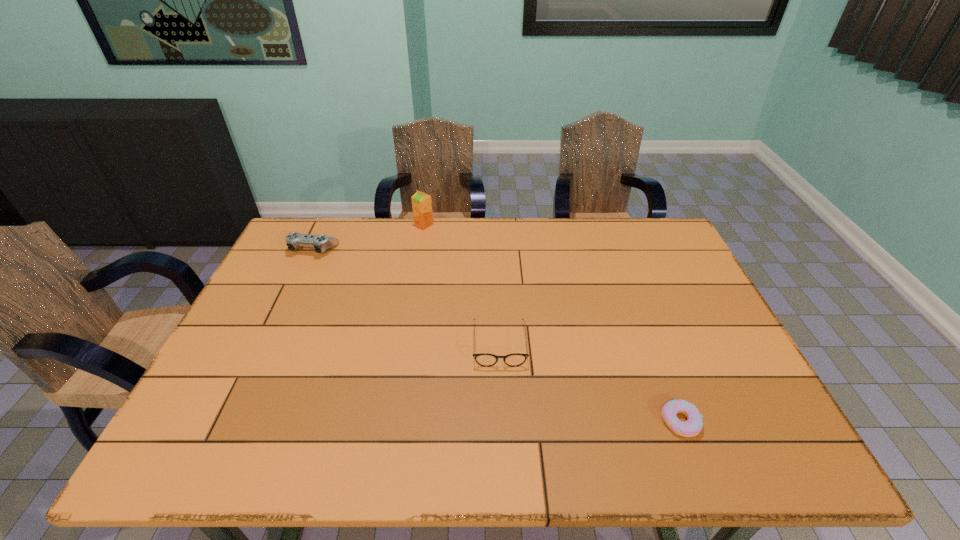
In the image, there is a desktop. What are the coordinates of `vacant region at the right edge` in the screenshot? It's located at (761, 414).

In the image, there is a desktop. At what (x,y) coordinates should I click in order to perform the action: click on free space at the far left corner. Please return your answer as a coordinate pair (x, y). Looking at the image, I should click on (304, 218).

The image size is (960, 540). I want to click on free space at the far right corner of the desktop, so click(x=644, y=239).

At what (x,y) coordinates should I click in order to perform the action: click on empty location between the shortest object and the third object from right to left. Please return your answer as a coordinate pair (x, y). Looking at the image, I should click on (552, 323).

Where is `free space between the tallest object and the second farthest object`? Image resolution: width=960 pixels, height=540 pixels. free space between the tallest object and the second farthest object is located at coordinates (369, 237).

Where is `free space between the tallest object and the rightmost object`? The width and height of the screenshot is (960, 540). free space between the tallest object and the rightmost object is located at coordinates (552, 323).

The height and width of the screenshot is (540, 960). Find the location of `free area in between the third object from left to right and the farthest object`. free area in between the third object from left to right and the farthest object is located at coordinates (462, 285).

Find the location of a particular element. This screenshot has height=540, width=960. free space that is in between the rightmost object and the third nearest object is located at coordinates (497, 335).

Image resolution: width=960 pixels, height=540 pixels. What are the coordinates of `free space between the second nearest object and the shortest object` in the screenshot? It's located at (589, 383).

Where is `unoccupied position between the second farthest object and the rightmost object`? unoccupied position between the second farthest object and the rightmost object is located at coordinates (497, 335).